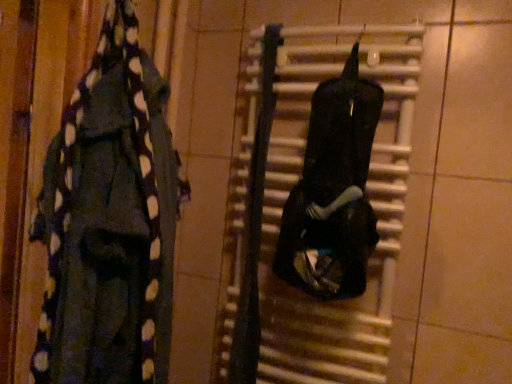
Question: Is black matte radiator at center shorter than black matte backpack at center, the 1th clothing viewed from the right?

Choices:
 (A) no
 (B) yes

Answer: (A)

Question: Does black matte radiator at center touch black matte backpack at center, the 1th clothing viewed from the right?

Choices:
 (A) no
 (B) yes

Answer: (A)

Question: Is black matte radiator at center positioned far away from black matte backpack at center, the 1th clothing viewed from the right?

Choices:
 (A) yes
 (B) no

Answer: (B)

Question: Does black matte radiator at center appear on the left side of black matte backpack at center, the second clothing from the left?

Choices:
 (A) yes
 (B) no

Answer: (A)

Question: Is black matte radiator at center not inside black matte backpack at center, the 1th clothing viewed from the right?

Choices:
 (A) yes
 (B) no

Answer: (A)

Question: Considering the relative positions of black matte radiator at center and black matte backpack at center, the second clothing from the left, in the image provided, is black matte radiator at center to the right of black matte backpack at center, the second clothing from the left, from the viewer's perspective?

Choices:
 (A) no
 (B) yes

Answer: (A)

Question: Does black polka dot scarf at left, positioned as the first clothing in left-to-right order, come behind black matte backpack at center, the 1th clothing viewed from the right?

Choices:
 (A) no
 (B) yes

Answer: (A)

Question: Can we say black polka dot scarf at left, which ranks as the 2th clothing in right-to-left order, lies outside black matte backpack at center, the 1th clothing viewed from the right?

Choices:
 (A) no
 (B) yes

Answer: (B)

Question: Can you confirm if black polka dot scarf at left, positioned as the first clothing in left-to-right order, is thinner than black matte backpack at center, the 1th clothing viewed from the right?

Choices:
 (A) yes
 (B) no

Answer: (B)

Question: Are black polka dot scarf at left, which ranks as the 2th clothing in right-to-left order, and black matte backpack at center, the second clothing from the left, located far from each other?

Choices:
 (A) yes
 (B) no

Answer: (B)

Question: From a real-world perspective, is black polka dot scarf at left, which ranks as the 2th clothing in right-to-left order, over black matte backpack at center, the second clothing from the left?

Choices:
 (A) no
 (B) yes

Answer: (A)

Question: Considering the relative sizes of black polka dot scarf at left, which ranks as the 2th clothing in right-to-left order, and black matte backpack at center, the second clothing from the left, in the image provided, is black polka dot scarf at left, which ranks as the 2th clothing in right-to-left order, smaller than black matte backpack at center, the second clothing from the left,?

Choices:
 (A) yes
 (B) no

Answer: (B)

Question: Can you confirm if black matte radiator at center is positioned to the right of black polka dot scarf at left, which ranks as the 2th clothing in right-to-left order?

Choices:
 (A) yes
 (B) no

Answer: (A)